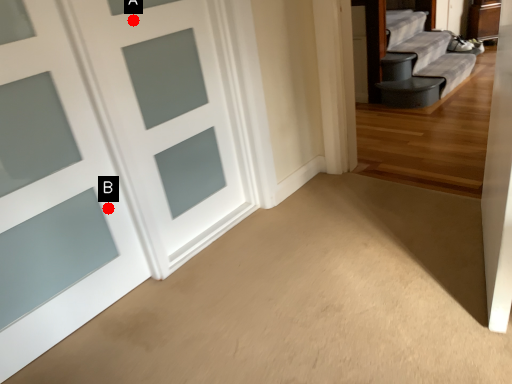
Question: Two points are circled on the image, labeled by A and B beside each circle. Which point is farther to the camera?

Choices:
 (A) A is further
 (B) B is further

Answer: (B)